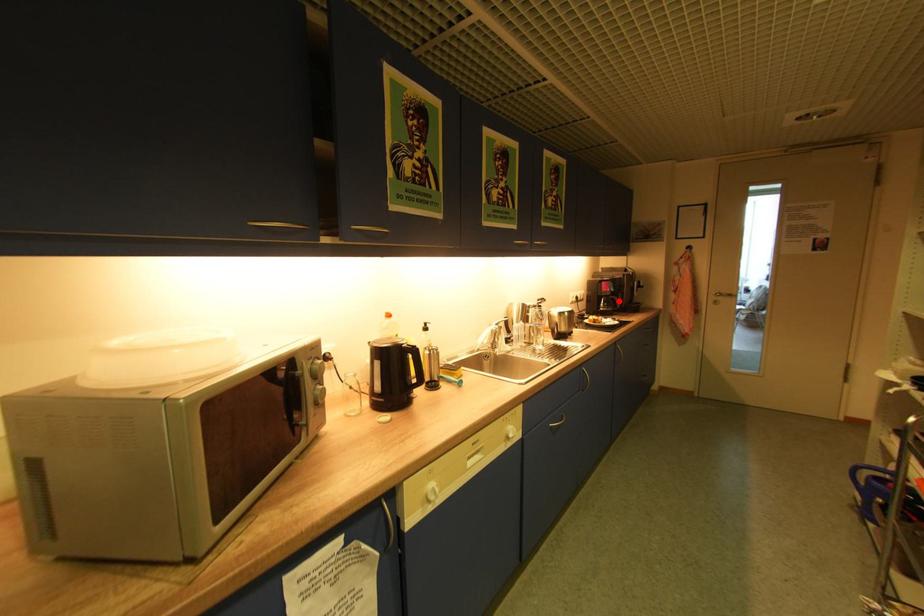
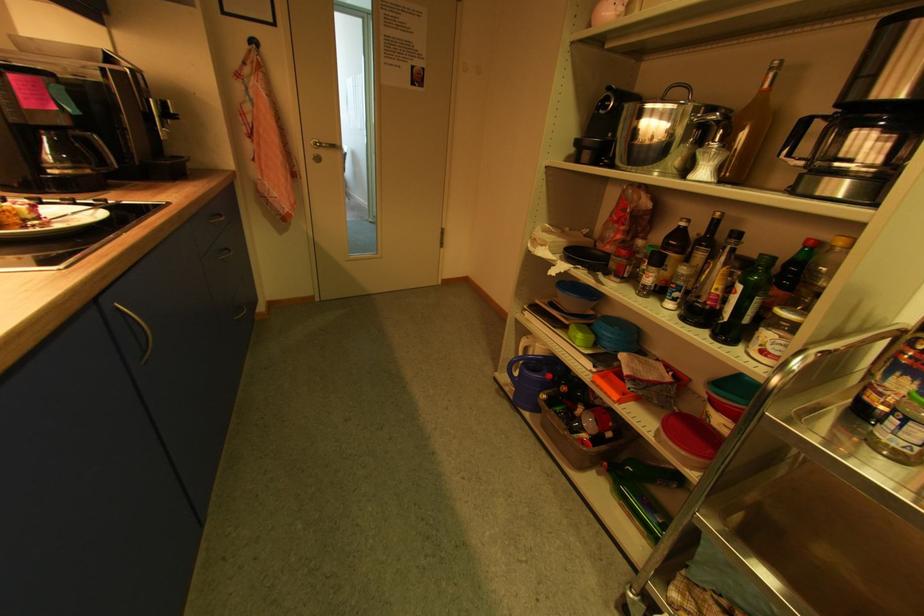
Where in the second image is the point corresponding to the highlighted location from the first image?

(94, 145)